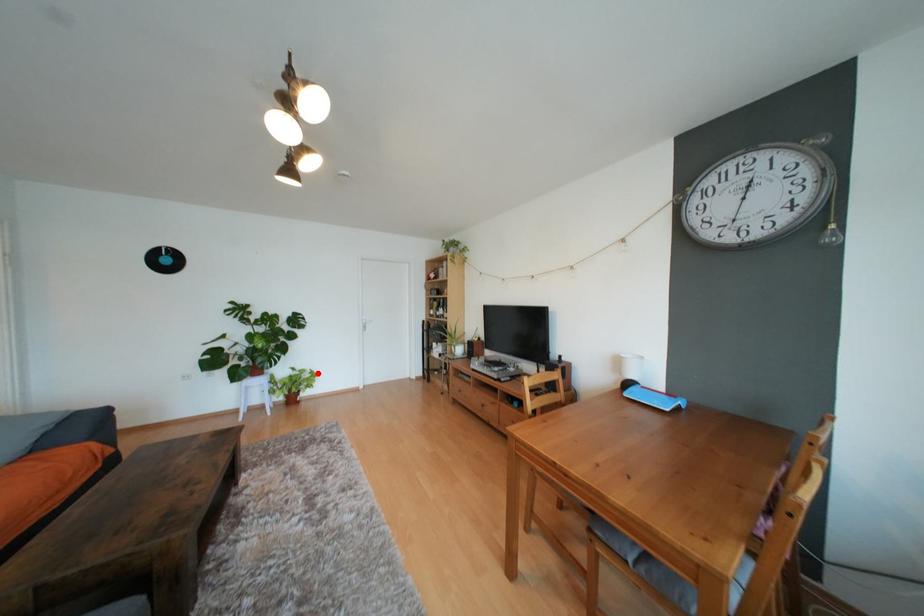
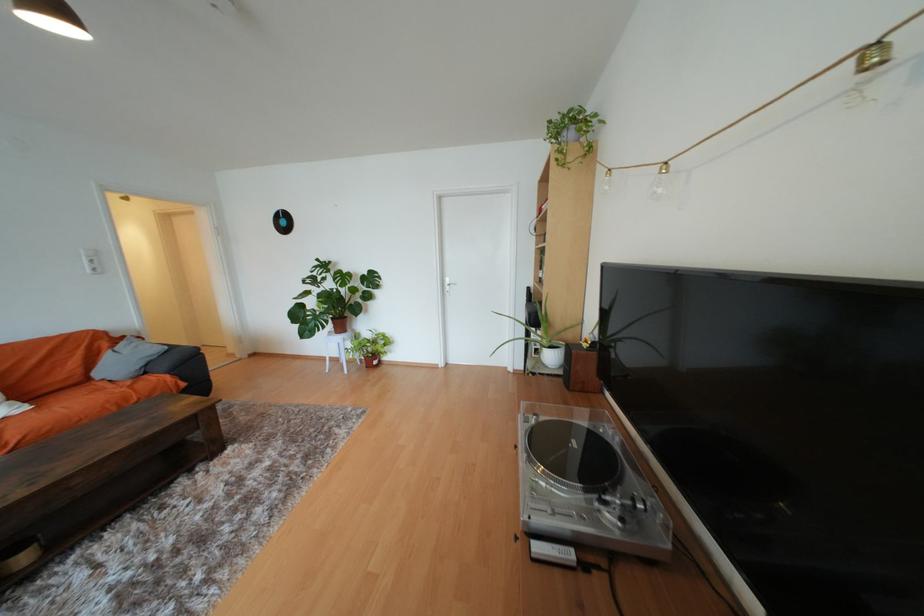
Question: I am providing you with two images of the same scene from different viewpoints. In image1, a red point is highlighted. Considering the same 3D point in image2, which of the following is correct?

Choices:
 (A) It is closer
 (B) It is farther

Answer: (B)